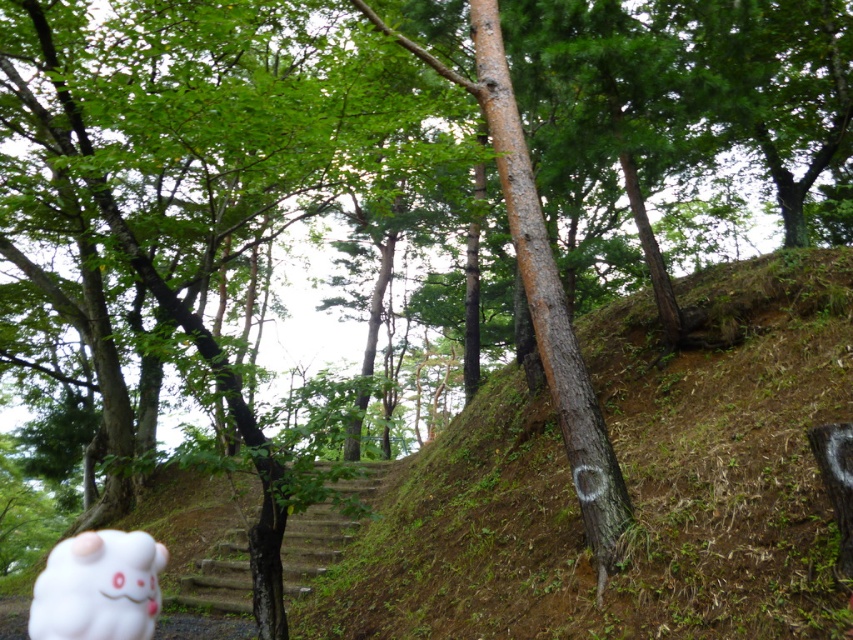
Is white fluffy plushie at lower left smaller than smooth concrete stairs at center?

Indeed, white fluffy plushie at lower left has a smaller size compared to smooth concrete stairs at center.

Does white fluffy plushie at lower left appear under smooth concrete stairs at center?

Actually, white fluffy plushie at lower left is above smooth concrete stairs at center.

Locate an element on the screen. Image resolution: width=853 pixels, height=640 pixels. white fluffy plushie at lower left is located at coordinates click(97, 588).

This screenshot has width=853, height=640. I want to click on brown dirt hillside at center, so click(630, 484).

Is brown dirt hillside at center further to the viewer compared to white fluffy plushie at lower left?

Yes, brown dirt hillside at center is further from the viewer.

Can you confirm if brown dirt hillside at center is positioned above white fluffy plushie at lower left?

Yes.

Where is `brown dirt hillside at center`? This screenshot has width=853, height=640. brown dirt hillside at center is located at coordinates (630, 484).

Where is `brown dirt hillside at center`? The image size is (853, 640). brown dirt hillside at center is located at coordinates (630, 484).